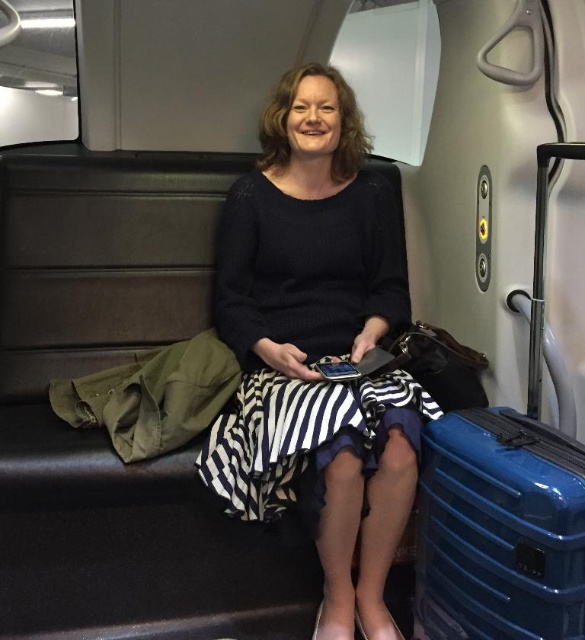
Question: Is black striped dress at center smaller than blue hardshell suitcase at lower right?

Choices:
 (A) no
 (B) yes

Answer: (A)

Question: Is black striped dress at center closer to the viewer compared to blue hardshell suitcase at lower right?

Choices:
 (A) yes
 (B) no

Answer: (B)

Question: Which object is farther from the camera taking this photo?

Choices:
 (A) blue hardshell suitcase at lower right
 (B) black striped dress at center

Answer: (B)

Question: Is black striped dress at center smaller than blue hardshell suitcase at lower right?

Choices:
 (A) no
 (B) yes

Answer: (A)